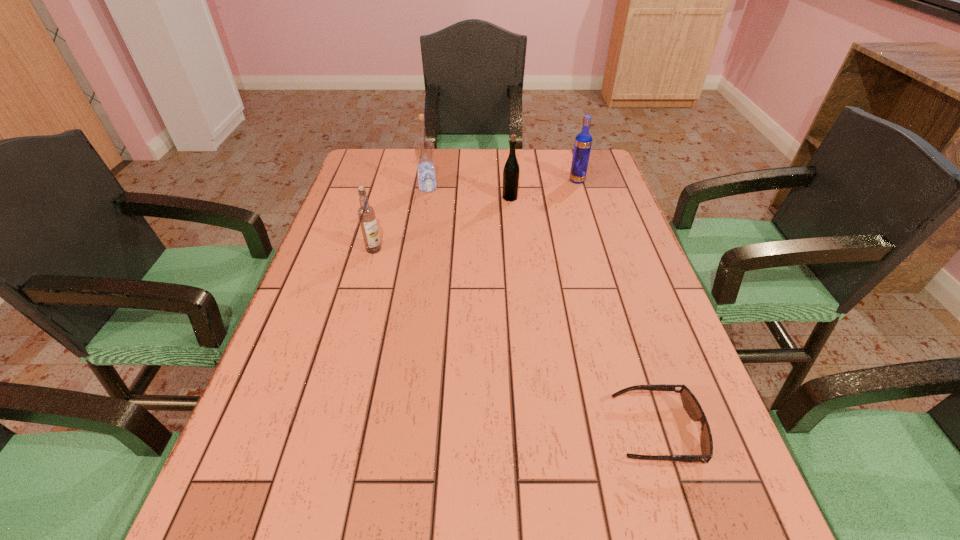
Locate an element on the screen. The height and width of the screenshot is (540, 960). empty space between the shortest object and the third object from right to left is located at coordinates (584, 314).

Image resolution: width=960 pixels, height=540 pixels. In order to click on vacant area that lies between the second object from left to right and the third nearest object in this screenshot , I will do `click(468, 193)`.

The height and width of the screenshot is (540, 960). In order to click on empty space between the sunglasses and the rightmost vodka in this screenshot , I will do `click(616, 306)`.

The width and height of the screenshot is (960, 540). Identify the location of object that is the second nearest to the leftmost object. (511, 171).

Locate which object ranks third in proximity to the second vodka from left to right. Please provide its 2D coordinates. Your answer should be formatted as a tuple, i.e. [(x, y)], where the tuple contains the x and y coordinates of a point satisfying the conditions above.

[(583, 141)]

Image resolution: width=960 pixels, height=540 pixels. What are the coordinates of `vodka that is the second closest to the rightmost vodka` in the screenshot? It's located at (366, 213).

Select which vodka is the closest to the fourth object from right to left. Please provide its 2D coordinates. Your answer should be formatted as a tuple, i.e. [(x, y)], where the tuple contains the x and y coordinates of a point satisfying the conditions above.

[(366, 213)]

At what (x,y) coordinates should I click in order to perform the action: click on vacant space that satisfies the following two spatial constraints: 1. on the back side of the rightmost vodka; 2. on the right side of the beer bottle. Please return your answer as a coordinate pair (x, y). The image size is (960, 540). Looking at the image, I should click on (509, 181).